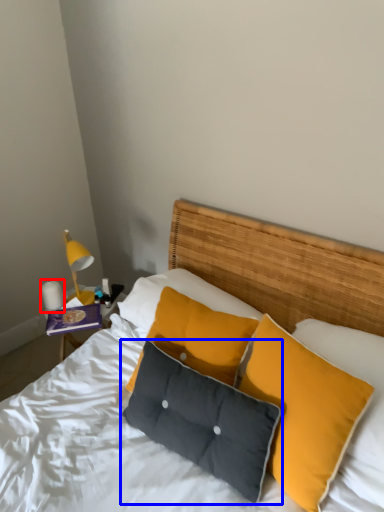
Question: Which object appears farthest to the camera in this image, lamp (highlighted by a red box) or pillow (highlighted by a blue box)?

Choices:
 (A) lamp
 (B) pillow

Answer: (A)